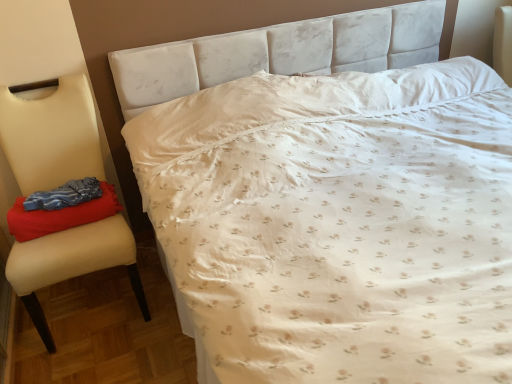
Question: Considering the positions of point (49, 238) and point (103, 216), is point (49, 238) closer or farther from the camera than point (103, 216)?

Choices:
 (A) farther
 (B) closer

Answer: (B)

Question: Looking at their shapes, would you say beige leather chair at left is wider or thinner than velvety red blanket at left?

Choices:
 (A) thin
 (B) wide

Answer: (B)

Question: Based on their sizes in the image, would you say beige leather chair at left is bigger or smaller than velvety red blanket at left?

Choices:
 (A) small
 (B) big

Answer: (B)

Question: Would you say velvety red blanket at left is to the left or to the right of beige leather chair at left in the picture?

Choices:
 (A) left
 (B) right

Answer: (B)

Question: Does point (30, 213) appear closer or farther from the camera than point (71, 264)?

Choices:
 (A) farther
 (B) closer

Answer: (A)

Question: Considering the positions of velvety red blanket at left and beige leather chair at left in the image, is velvety red blanket at left taller or shorter than beige leather chair at left?

Choices:
 (A) tall
 (B) short

Answer: (B)

Question: Is velvety red blanket at left bigger or smaller than beige leather chair at left?

Choices:
 (A) small
 (B) big

Answer: (A)